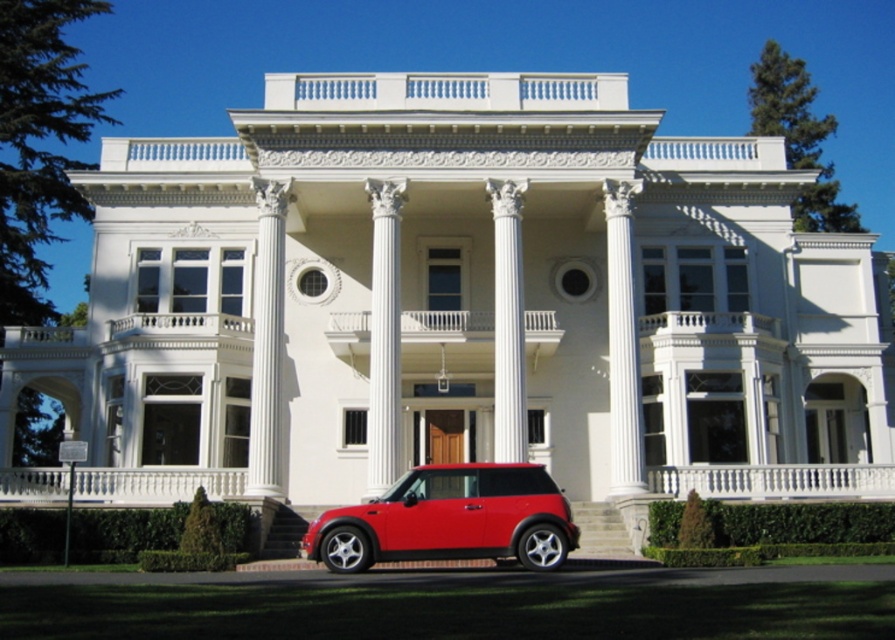
Question: Is glossy red car at lower center closer to camera compared to white glossy column at center?

Choices:
 (A) no
 (B) yes

Answer: (B)

Question: Can you confirm if glossy red car at lower center is positioned below white glossy column at center?

Choices:
 (A) yes
 (B) no

Answer: (A)

Question: Among these points, which one is farthest from the camera?

Choices:
 (A) (355, 515)
 (B) (378, 454)
 (C) (500, 266)

Answer: (C)

Question: Which point is farther to the camera?

Choices:
 (A) (496, 416)
 (B) (381, 292)

Answer: (B)

Question: Considering the relative positions of glossy red car at lower center and white glossy column at center in the image provided, where is glossy red car at lower center located with respect to white glossy column at center?

Choices:
 (A) right
 (B) left

Answer: (B)

Question: Among these objects, which one is farthest from the camera?

Choices:
 (A) glossy red car at lower center
 (B) white marble column at center

Answer: (B)